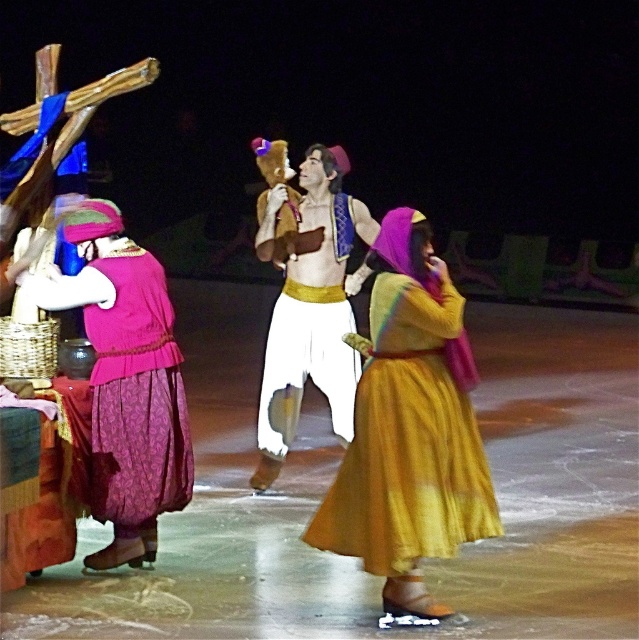
Question: Which is farther from the white satin pants at center?

Choices:
 (A) purple satin dress at left
 (B) yellow satin dress at center

Answer: (A)

Question: Is white satin pants at center wider than purple satin dress at left?

Choices:
 (A) yes
 (B) no

Answer: (A)

Question: Which point appears farthest from the camera in this image?

Choices:
 (A) (272, 417)
 (B) (173, 388)
 (C) (427, 308)

Answer: (A)

Question: Does white satin pants at center appear under purple satin dress at left?

Choices:
 (A) no
 (B) yes

Answer: (A)

Question: Does yellow satin dress at center come in front of white satin pants at center?

Choices:
 (A) no
 (B) yes

Answer: (B)

Question: Which point is farther from the camera taking this photo?

Choices:
 (A) (134, 380)
 (B) (320, 344)

Answer: (B)